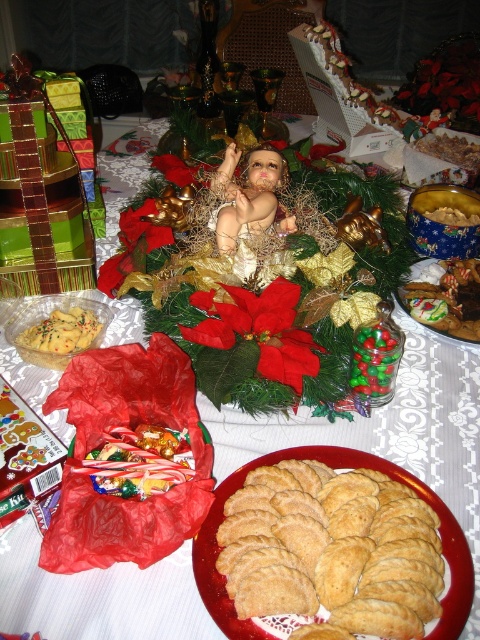
You are a guest at a holiday party and see the golden brown cookie at center and the shiny chocolate cookies at center on the festive table. Which cookie is taller?

The golden brown cookie at center is shorter than the shiny chocolate cookies at center, so the shiny chocolate cookies at center are taller.

You are a guest at the table and want to reach both the smooth porcelain baby at center and the shiny chocolate cookies at center. Which item will you need to move first to access the other?

The smooth porcelain baby at center is closer to the viewer than the shiny chocolate cookies at center, so you would need to move the smooth porcelain baby at center first to access the shiny chocolate cookies at center.